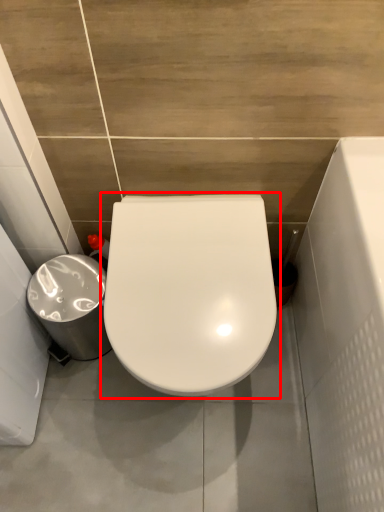
Question: From the image's perspective, considering the relative positions of toilet (annotated by the red box) and porcelain in the image provided, where is toilet (annotated by the red box) located with respect to the staircase?

Choices:
 (A) above
 (B) below

Answer: (B)